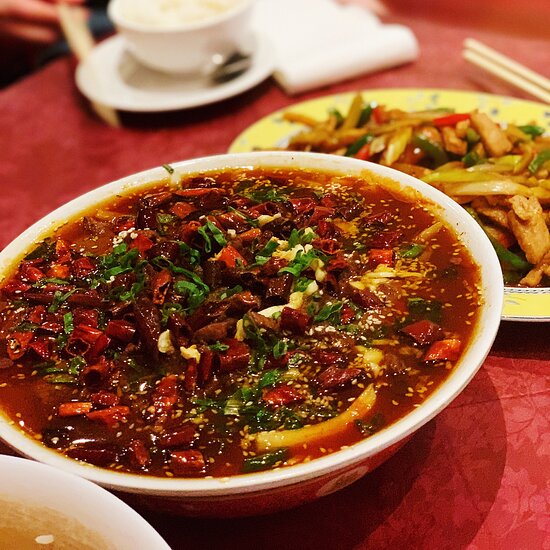
The width and height of the screenshot is (550, 550). Find the location of `white saucer under coffee cup`. white saucer under coffee cup is located at coordinates (133, 104).